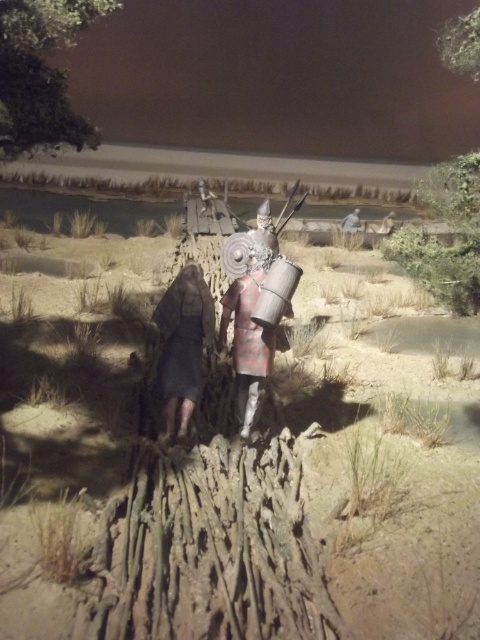
Is green leafy tree at upper left behind shiny silver armor at center?

No, green leafy tree at upper left is closer to the viewer.

Which of these two, green leafy tree at upper left or shiny silver armor at center, stands shorter?

Standing shorter between the two is green leafy tree at upper left.

At what (x,y) coordinates should I click in order to perform the action: click on green leafy tree at upper left. Please return your answer as a coordinate pair (x, y). This screenshot has height=640, width=480. Looking at the image, I should click on (41, 72).

You are a GUI agent. You are given a task and a screenshot of the screen. Output one action in this format:
    pyautogui.click(x=<x>, y=<y>)
    Task: Click on the shiny silver armor at center
    The width and height of the screenshot is (480, 640).
    Given the screenshot: What is the action you would take?
    pyautogui.click(x=248, y=320)

Is shiny silver armor at center in front of dark gray fabric dress at center?

No, shiny silver armor at center is further to the viewer.

Image resolution: width=480 pixels, height=640 pixels. What do you see at coordinates (248, 320) in the screenshot?
I see `shiny silver armor at center` at bounding box center [248, 320].

Locate an element on the screen. The height and width of the screenshot is (640, 480). shiny silver armor at center is located at coordinates (248, 320).

Is point (1, 10) more distant than point (466, 234)?

No, (1, 10) is in front of (466, 234).

At what (x,y) coordinates should I click in order to perform the action: click on green leafy tree at upper left. Please return your answer as a coordinate pair (x, y). Image resolution: width=480 pixels, height=640 pixels. Looking at the image, I should click on (41, 72).